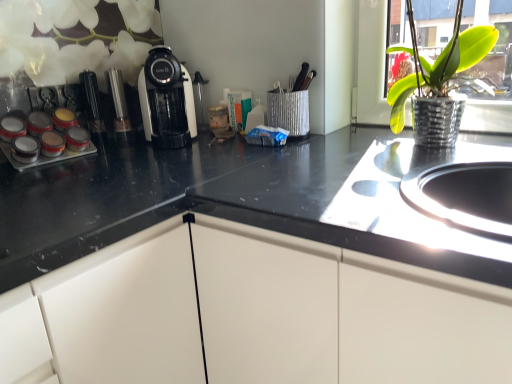
Question: Would you say metallic silver spice rack at left is a long distance from green metallic pot at upper right?

Choices:
 (A) no
 (B) yes

Answer: (A)

Question: Considering the relative sizes of metallic silver spice rack at left and green metallic pot at upper right in the image provided, is metallic silver spice rack at left taller than green metallic pot at upper right?

Choices:
 (A) no
 (B) yes

Answer: (A)

Question: Is metallic silver spice rack at left not within green metallic pot at upper right?

Choices:
 (A) yes
 (B) no

Answer: (A)

Question: Is metallic silver spice rack at left oriented away from green metallic pot at upper right?

Choices:
 (A) yes
 (B) no

Answer: (B)

Question: Does metallic silver spice rack at left lie in front of green metallic pot at upper right?

Choices:
 (A) no
 (B) yes

Answer: (A)

Question: From a real-world perspective, relative to green metallic pot at upper right, is metallic silver spice rack at left vertically above or below?

Choices:
 (A) below
 (B) above

Answer: (A)

Question: In terms of size, does metallic silver spice rack at left appear bigger or smaller than green metallic pot at upper right?

Choices:
 (A) small
 (B) big

Answer: (A)

Question: Is metallic silver spice rack at left to the left or to the right of green metallic pot at upper right in the image?

Choices:
 (A) left
 (B) right

Answer: (A)

Question: Is metallic silver spice rack at left inside or outside of green metallic pot at upper right?

Choices:
 (A) inside
 (B) outside

Answer: (B)

Question: In the image, is green metallic pot at upper right positioned in front of or behind metallic silver spice rack at left?

Choices:
 (A) behind
 (B) front

Answer: (B)

Question: From a real-world perspective, is green metallic pot at upper right positioned above or below metallic silver spice rack at left?

Choices:
 (A) below
 (B) above

Answer: (B)

Question: Is green metallic pot at upper right taller or shorter than metallic silver spice rack at left?

Choices:
 (A) short
 (B) tall

Answer: (B)

Question: Looking at the image, does green metallic pot at upper right seem bigger or smaller compared to metallic silver spice rack at left?

Choices:
 (A) small
 (B) big

Answer: (B)

Question: From a real-world perspective, is white glossy coffee machine at center physically located above or below green metallic pot at upper right?

Choices:
 (A) below
 (B) above

Answer: (A)

Question: Is white glossy coffee machine at center in front of or behind green metallic pot at upper right in the image?

Choices:
 (A) behind
 (B) front

Answer: (A)